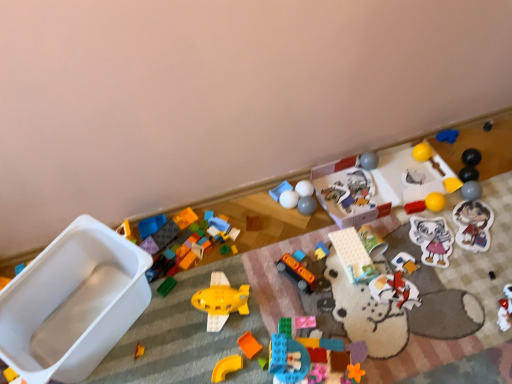
Locate an element on the screen. Image resolution: width=512 pixels, height=384 pixels. free space in front of yellow matte square at center-right, placed as the 22th toy when sorted from left to right is located at coordinates (463, 226).